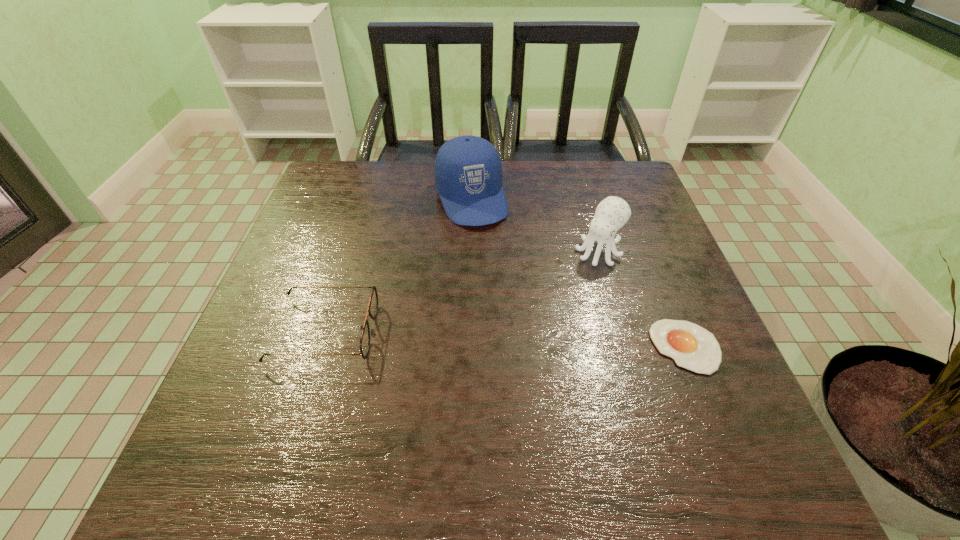
Where is `free space on the desktop that is between the sunglasses and the egg yolk and is positioned on the front-facing side of the second object from left to right`? The image size is (960, 540). free space on the desktop that is between the sunglasses and the egg yolk and is positioned on the front-facing side of the second object from left to right is located at coordinates (535, 340).

Where is `free space on the desktop that is between the sunglasses and the egg yolk and is positioned on the front-facing side of the octopus`? The image size is (960, 540). free space on the desktop that is between the sunglasses and the egg yolk and is positioned on the front-facing side of the octopus is located at coordinates (516, 340).